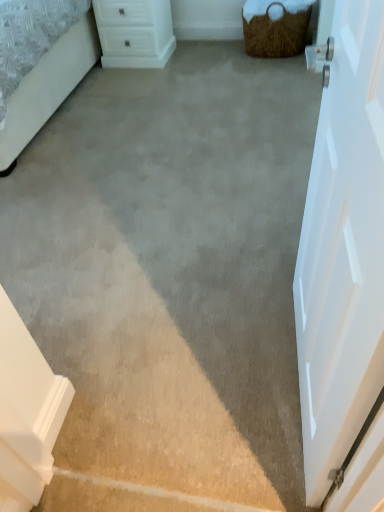
What are the coordinates of `vacant area in front of white plastic chest of drawers at upper center` in the screenshot? It's located at (134, 76).